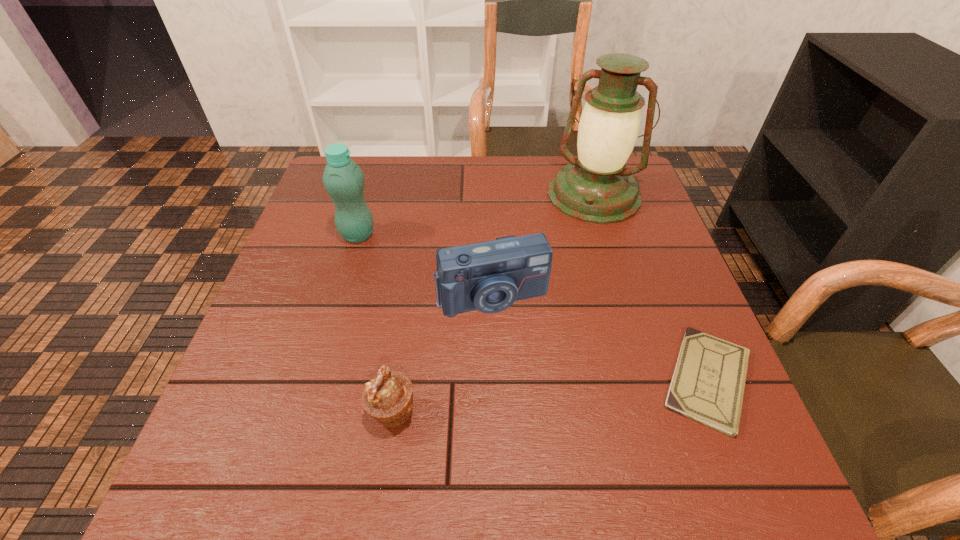
Where is `vacant area situated 0.050m on the lens of the camera`? The width and height of the screenshot is (960, 540). vacant area situated 0.050m on the lens of the camera is located at coordinates [x=513, y=338].

Where is `vacant space located 0.250m on the lens of the camera`? The width and height of the screenshot is (960, 540). vacant space located 0.250m on the lens of the camera is located at coordinates (546, 431).

The width and height of the screenshot is (960, 540). Find the location of `free space located on the lens of the camera`. free space located on the lens of the camera is located at coordinates (525, 372).

What are the coordinates of `free location located 0.340m at the front cap of the water bottle` in the screenshot? It's located at (469, 314).

Locate an element on the screen. This screenshot has width=960, height=540. blank space located at the front cap of the water bottle is located at coordinates (381, 252).

Where is `free point located at the front cap of the water bottle`? The height and width of the screenshot is (540, 960). free point located at the front cap of the water bottle is located at coordinates (400, 265).

In order to click on blank space located with the light compartment facing forward on the lantern in this screenshot , I will do `click(562, 276)`.

Find the location of a particular element. The image size is (960, 540). free space located 0.300m with the light compartment facing forward on the lantern is located at coordinates (551, 303).

At what (x,y) coordinates should I click in order to perform the action: click on free space located with the light compartment facing forward on the lantern. Please return your answer as a coordinate pair (x, y). Image resolution: width=960 pixels, height=540 pixels. Looking at the image, I should click on (574, 246).

Where is `object located in the far edge section of the desktop`? object located in the far edge section of the desktop is located at coordinates (595, 187).